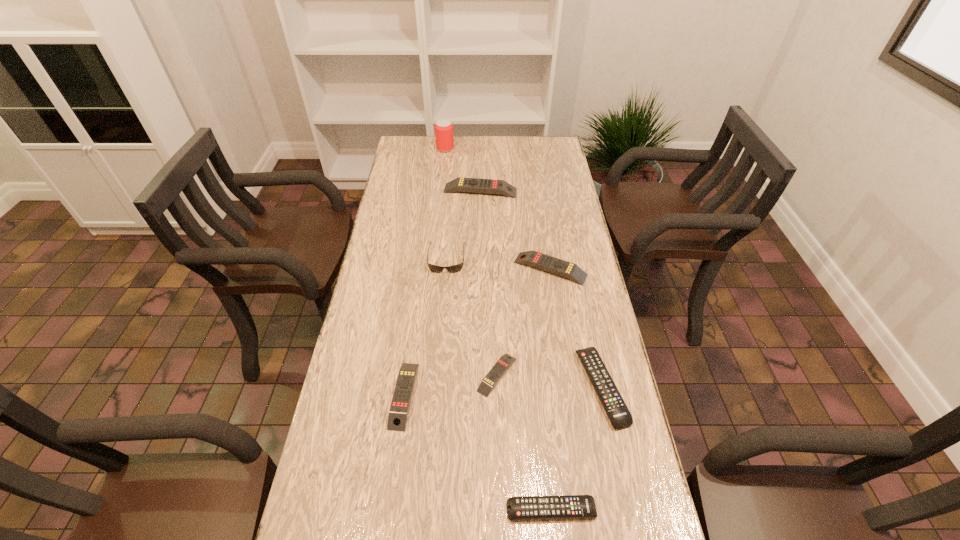
The height and width of the screenshot is (540, 960). I want to click on vacant region between the tallest remote control and the sunglasses, so click(464, 224).

At what (x,y) coordinates should I click in order to perform the action: click on free space between the leftmost yellow remote control and the nearest remote control. Please return your answer as a coordinate pair (x, y). Looking at the image, I should click on [478, 453].

I want to click on unoccupied position between the leftmost yellow remote control and the left black remote control, so click(x=478, y=453).

Locate an element on the screen. The width and height of the screenshot is (960, 540). free space between the fourth tallest object and the smallest yellow remote control is located at coordinates (523, 322).

Locate an element on the screen. This screenshot has height=540, width=960. free space between the sunglasses and the smallest yellow remote control is located at coordinates (471, 316).

Find the location of a particular element. This screenshot has width=960, height=540. vacant point located between the farthest object and the right black remote control is located at coordinates (523, 268).

This screenshot has height=540, width=960. Identify the location of the fourth closest object relative to the sunglasses. (397, 419).

Find the location of a particular element. The width and height of the screenshot is (960, 540). object that is the closest one to the bigger black remote control is located at coordinates (567, 506).

Image resolution: width=960 pixels, height=540 pixels. I want to click on remote control identified as the closest to the tallest remote control, so click(x=563, y=268).

At what (x,y) coordinates should I click in order to perform the action: click on remote control that is the fifth nearest to the red beer can. Please return your answer as a coordinate pair (x, y). This screenshot has height=540, width=960. Looking at the image, I should click on (619, 415).